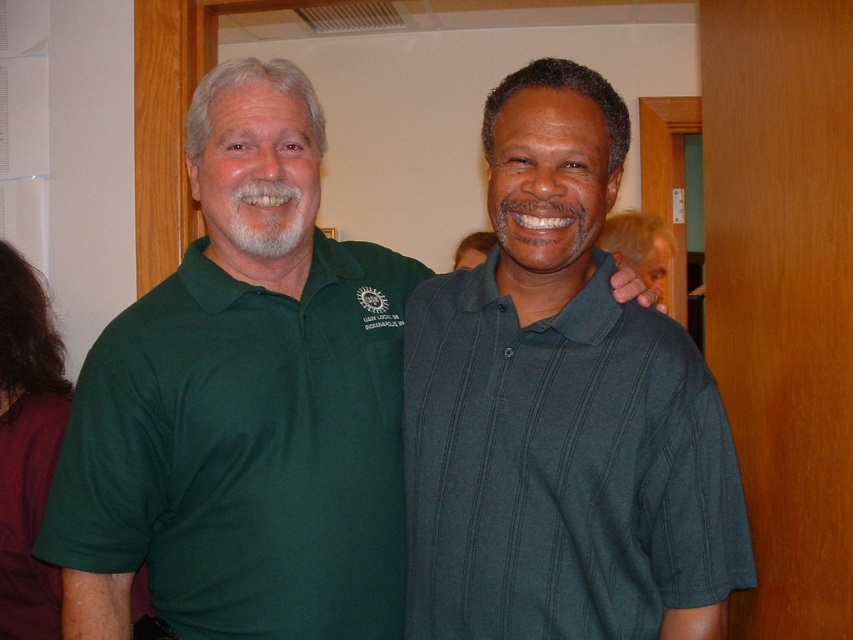
You are standing in a room and see the green polo shirt at left and the dark green ribbed polo shirt at center. Which one is closer to you?

The green polo shirt at left is closer to you because it is positioned further to the viewer than the dark green ribbed polo shirt at center.

You are standing in an office and see two people wearing green polo shirts. The green polo shirt at left and the dark green ribbed polo shirt at center. Which one is positioned more to the left side?

The green polo shirt at left is positioned more to the left side than the dark green ribbed polo shirt at center.

You are standing in the room and want to move closer to the camera. Which of the two points, point (219, 611) or point (604, 540), is closer to your current position if you are at the same depth as the wooden door frame?

Point (219, 611) is further to the camera than point (604, 540). Therefore, if you are at the same depth as the wooden door frame, point (604, 540) would be closer to your current position since it is nearer to the camera compared to point (219, 611).